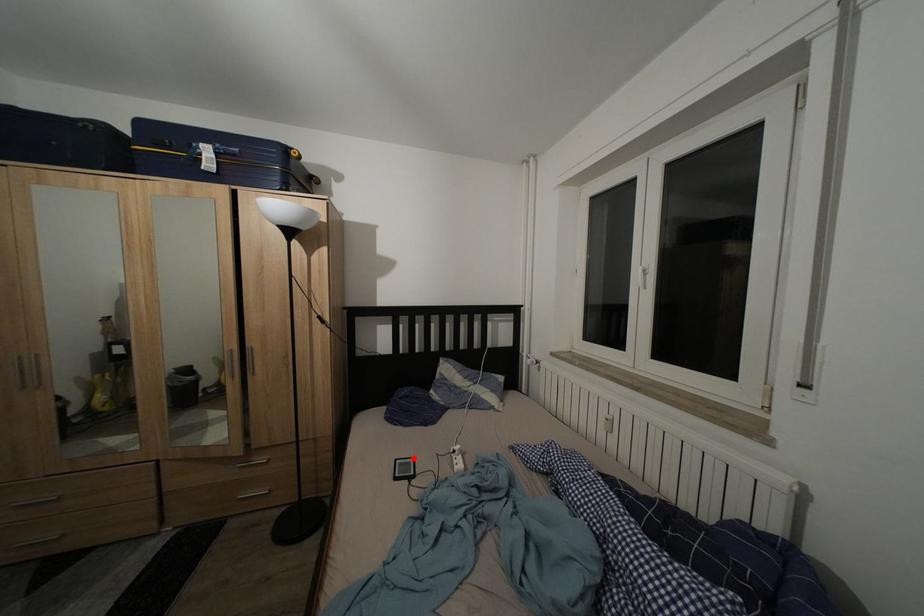
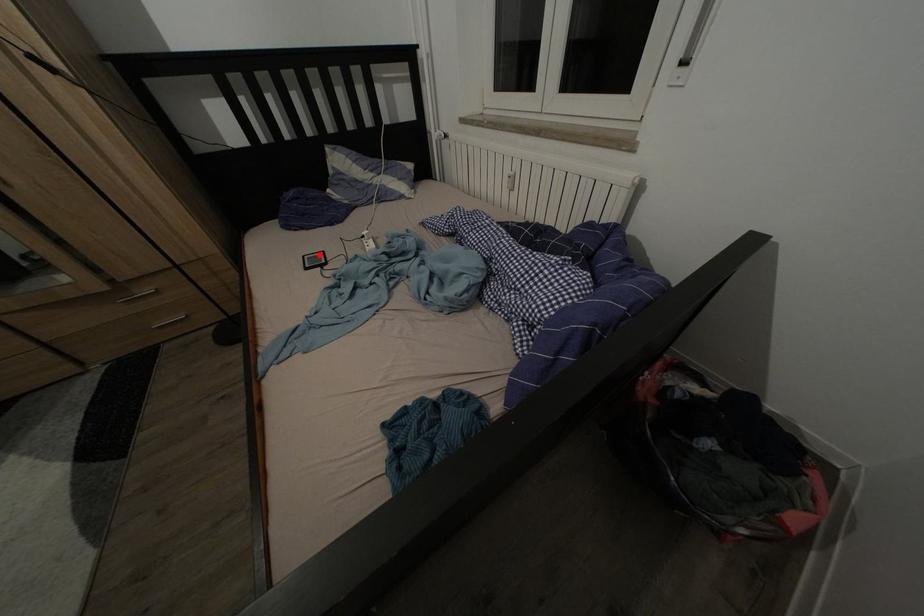
I am providing you with two images of the same scene from different viewpoints. A red point is marked on the first image and another point is marked on the second image. Is the marked point in image1 the same physical position as the marked point in image2?

Yes